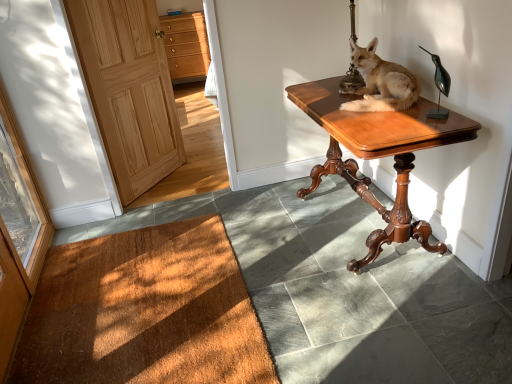
Question: Considering the relative sizes of bronze metallic bird at upper right and light brown fur at center in the image provided, is bronze metallic bird at upper right smaller than light brown fur at center?

Choices:
 (A) no
 (B) yes

Answer: (B)

Question: Is bronze metallic bird at upper right oriented towards light brown fur at center?

Choices:
 (A) no
 (B) yes

Answer: (A)

Question: From the image's perspective, is bronze metallic bird at upper right under light brown fur at center?

Choices:
 (A) no
 (B) yes

Answer: (B)

Question: Does bronze metallic bird at upper right have a greater height compared to light brown fur at center?

Choices:
 (A) yes
 (B) no

Answer: (B)

Question: Is bronze metallic bird at upper right not within light brown fur at center?

Choices:
 (A) no
 (B) yes

Answer: (B)

Question: Can you confirm if bronze metallic bird at upper right is wider than light brown fur at center?

Choices:
 (A) no
 (B) yes

Answer: (A)

Question: Does bronze metallic bird at upper right have a lesser width compared to light brown wood drawers at upper left?

Choices:
 (A) no
 (B) yes

Answer: (B)

Question: Would you say bronze metallic bird at upper right is a long distance from light brown wood drawers at upper left?

Choices:
 (A) yes
 (B) no

Answer: (A)

Question: Does bronze metallic bird at upper right appear on the left side of light brown wood drawers at upper left?

Choices:
 (A) no
 (B) yes

Answer: (A)

Question: From the image's perspective, is bronze metallic bird at upper right over light brown wood drawers at upper left?

Choices:
 (A) yes
 (B) no

Answer: (B)

Question: Is bronze metallic bird at upper right positioned with its back to light brown wood drawers at upper left?

Choices:
 (A) yes
 (B) no

Answer: (B)

Question: Is bronze metallic bird at upper right closer to camera compared to light brown wood drawers at upper left?

Choices:
 (A) yes
 (B) no

Answer: (A)

Question: Does light brown fur at center have a greater width compared to brown textured mat at lower left?

Choices:
 (A) no
 (B) yes

Answer: (A)